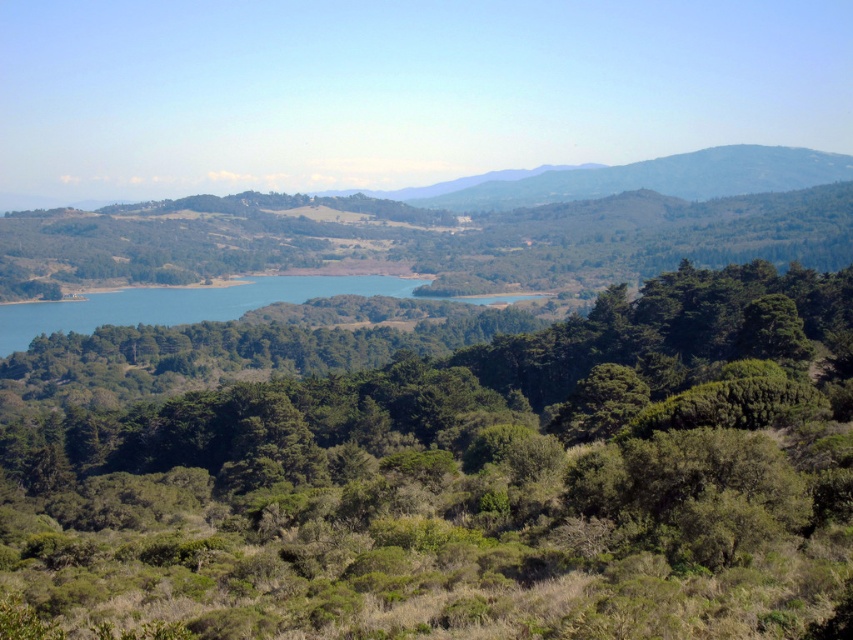
Question: Which object is closer to the camera taking this photo?

Choices:
 (A) blue water at center
 (B) green leafy tree at center

Answer: (B)

Question: Is green leafy tree at center below blue water at center?

Choices:
 (A) yes
 (B) no

Answer: (A)

Question: Considering the relative positions of green leafy tree at center and blue water at center in the image provided, where is green leafy tree at center located with respect to blue water at center?

Choices:
 (A) right
 (B) left

Answer: (A)

Question: Does green leafy tree at center appear on the left side of blue water at center?

Choices:
 (A) no
 (B) yes

Answer: (A)